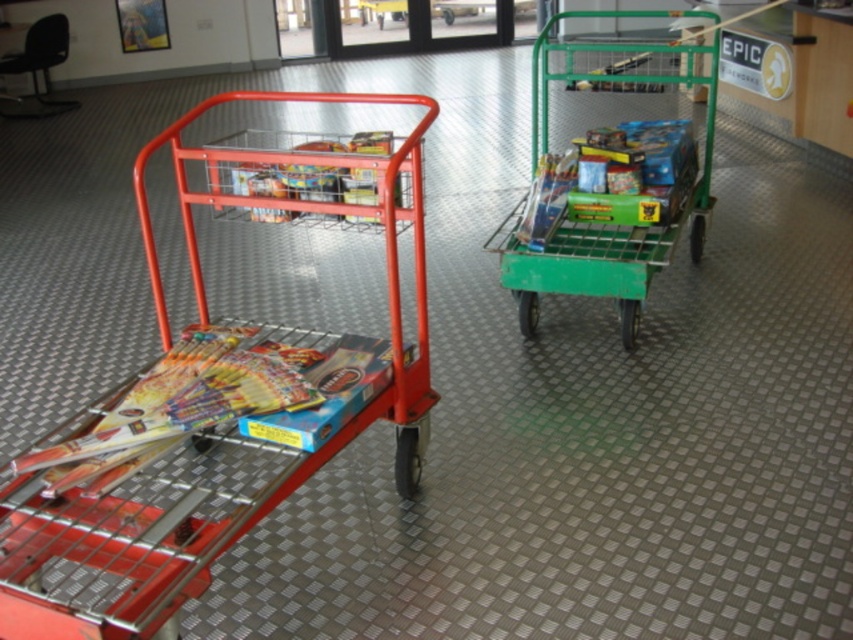
You are an employee in a warehouse and need to move both the metallic red shopping cart at left and the green metal trolley at right through a narrow doorway that is 1.2 meters wide. Based on their widths, can both carts pass through the doorway without any adjustments?

The metallic red shopping cart at left might be wider than green metal trolley at right. Since the doorway is 1.2 meters wide, if the red cart is indeed wider than the green one, it might not fit through the doorway. However, without exact measurements, we cannot be certain. The green metal trolley at right is more likely to fit, but the metallic red shopping cart at left may be too wide.

You are an employee who needs to move items from the metallic red shopping cart at left to the green metal trolley at right. Which cart should you start with to maintain the shortest path while moving items?

You should start with the metallic red shopping cart at left because it is positioned to the left of the green metal trolley at right, so moving items from the left cart first would minimize backtracking.

Consider the image. You are standing at the center of the room. Where is the metallic red shopping cart at left located relative to you?

The metallic red shopping cart at left is located at point 0.617 on the x axis and 0.257 on the y axis relative to you.